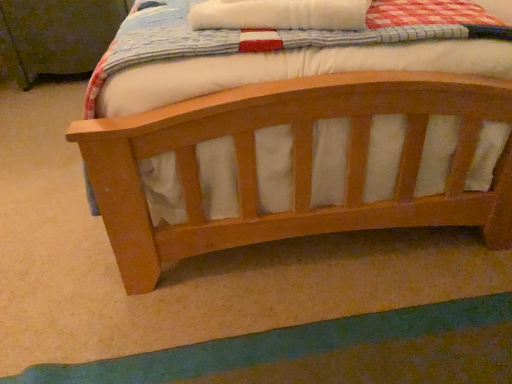
Question: From a real-world perspective, is light brown wood bed at center above or below green fabric at lower center?

Choices:
 (A) below
 (B) above

Answer: (A)

Question: Is light brown wood bed at center wider or thinner than green fabric at lower center?

Choices:
 (A) thin
 (B) wide

Answer: (B)

Question: Which is farther from the wooden changing table at upper left?

Choices:
 (A) light brown wood bed at center
 (B) green fabric at lower center

Answer: (B)

Question: Which object is positioned closest to the green fabric at lower center?

Choices:
 (A) light brown wood bed at center
 (B) wooden changing table at upper left

Answer: (A)